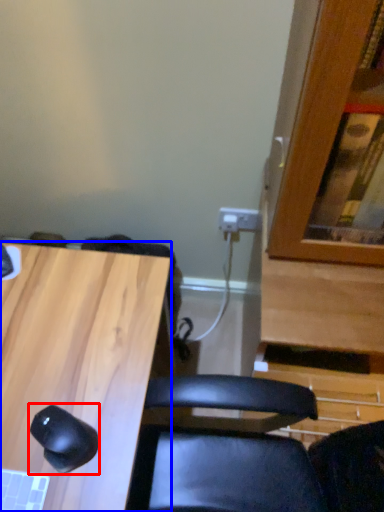
Question: Which point is closer to the camera, mouse (highlighted by a red box) or desk (highlighted by a blue box)?

Choices:
 (A) mouse
 (B) desk

Answer: (B)